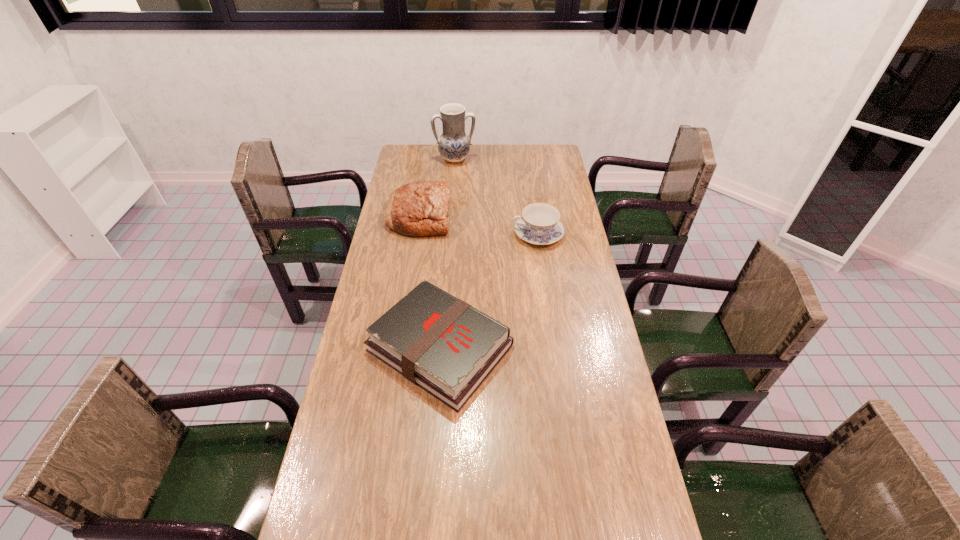
You are a GUI agent. You are given a task and a screenshot of the screen. Output one action in this format:
    pyautogui.click(x=<x>, y=<y>)
    Task: Click on the pottery
    
    Given the screenshot: What is the action you would take?
    coord(454,145)

I want to click on the farthest object, so click(x=454, y=145).

At what (x,y) coordinates should I click in order to perform the action: click on the second tallest object. Please return your answer as a coordinate pair (x, y). Looking at the image, I should click on (421, 208).

Image resolution: width=960 pixels, height=540 pixels. Find the location of `hardback book`. hardback book is located at coordinates (440, 343).

I want to click on the rightmost object, so tap(539, 224).

The width and height of the screenshot is (960, 540). Identify the location of vacant area located on the front of the farthest object. (454, 174).

The width and height of the screenshot is (960, 540). I want to click on free space located 0.270m at the sliced front of the bread, so 516,217.

This screenshot has width=960, height=540. In order to click on free location located on the back of the hardback book in this screenshot , I will do `click(447, 253)`.

Find the location of `vacant space situated with the handle on the side of the rightmost object`. vacant space situated with the handle on the side of the rightmost object is located at coordinates [412, 234].

Where is `vacant space situated 0.370m with the handle on the side of the rightmost object`? This screenshot has width=960, height=540. vacant space situated 0.370m with the handle on the side of the rightmost object is located at coordinates pos(419,234).